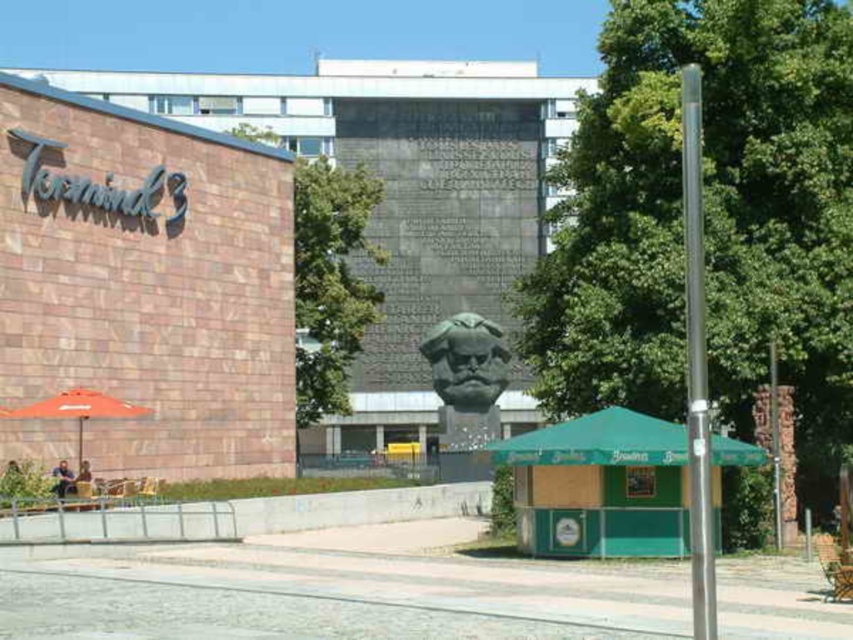
Who is more distant from viewer, (154,93) or (80,435)?

Point (154,93)

Between matte brick mall at left and orange fabric umbrella at lower left, which one appears on the right side from the viewer's perspective?

From the viewer's perspective, matte brick mall at left appears more on the right side.

Between point (451, 289) and point (19, 417), which one is positioned in front?

Point (19, 417)

You are a GUI agent. You are given a task and a screenshot of the screen. Output one action in this format:
    pyautogui.click(x=<x>, y=<y>)
    Task: Click on the matte brick mall at left
    The image size is (853, 640).
    Given the screenshot: What is the action you would take?
    pyautogui.click(x=393, y=193)

Identify the location of matte brick mall at left. (393, 193).

Does point (509, 355) come behind point (19, 412)?

Yes.

The image size is (853, 640). Identify the location of green polished stone bust at center. 466,362.